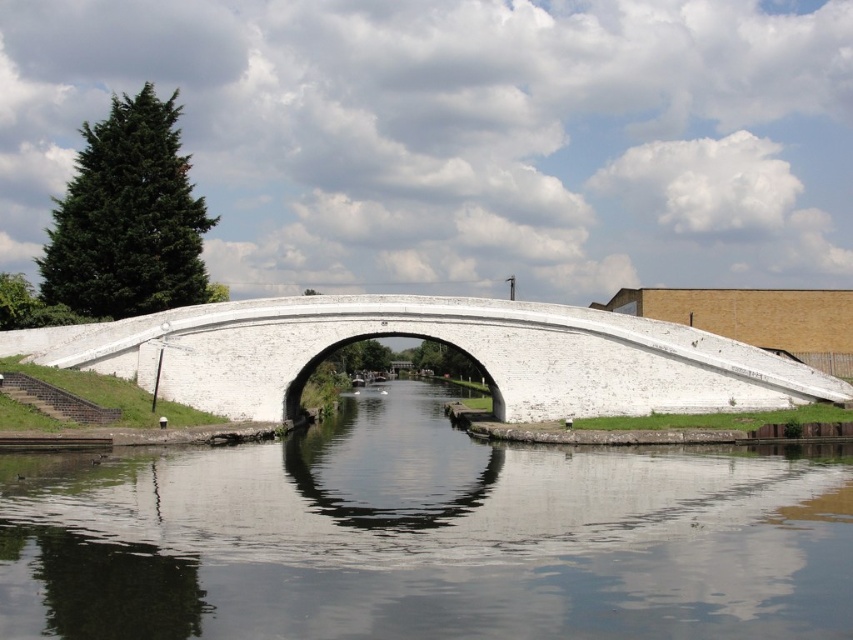
Question: Which point is closer to the camera taking this photo?

Choices:
 (A) (392, 330)
 (B) (160, 460)

Answer: (B)

Question: Which point is closer to the camera?

Choices:
 (A) (395, 500)
 (B) (316, 337)

Answer: (A)

Question: Can you confirm if smooth concrete water at center is positioned to the left of white concrete bridge at center?

Choices:
 (A) no
 (B) yes

Answer: (A)

Question: Where is smooth concrete water at center located in relation to white concrete bridge at center in the image?

Choices:
 (A) below
 (B) above

Answer: (A)

Question: Can you confirm if smooth concrete water at center is thinner than white concrete bridge at center?

Choices:
 (A) yes
 (B) no

Answer: (A)